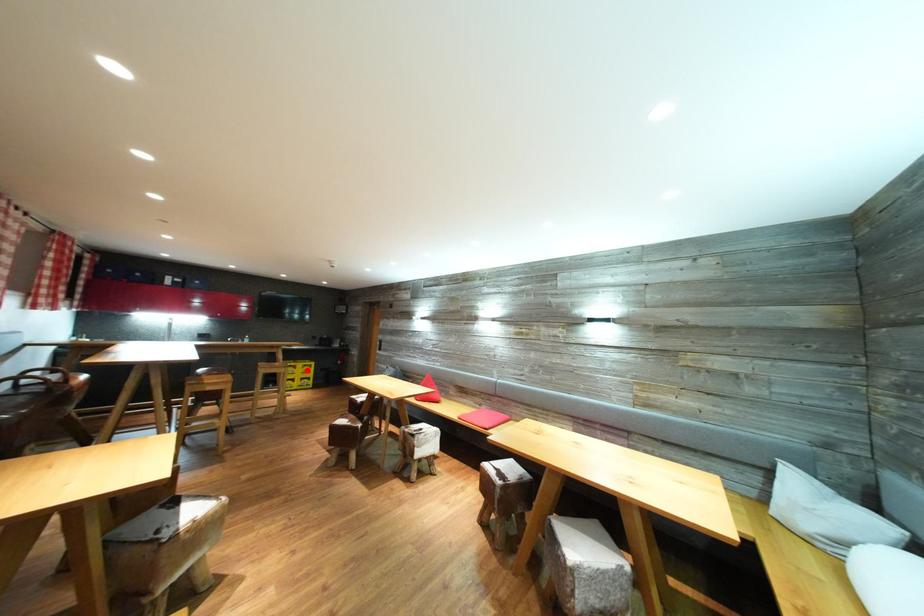
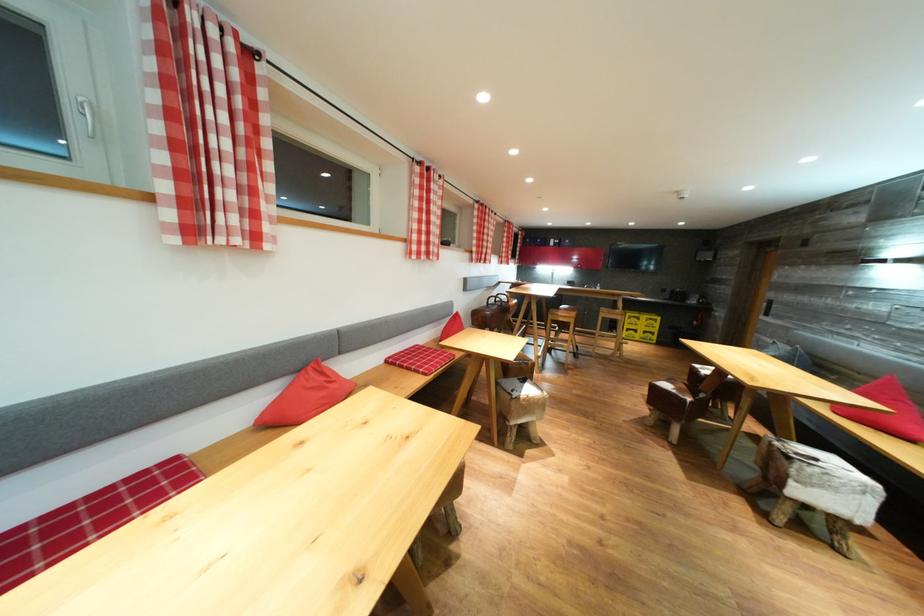
Where in the second image is the point corresponding to the highlighted location from the first image?

(650, 323)